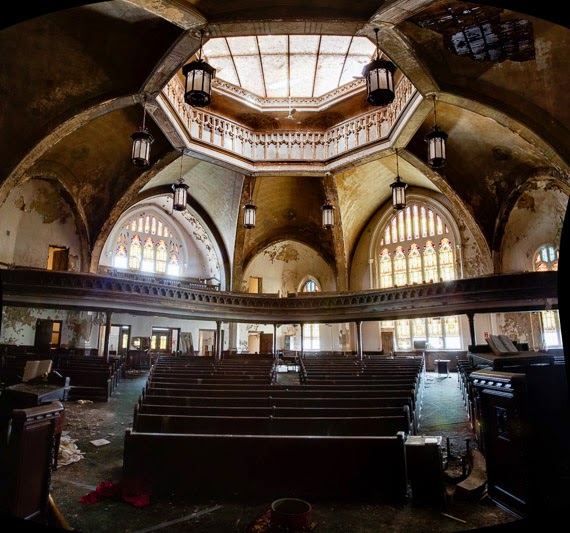
Locate an element on the screen. door is located at coordinates (266, 339).